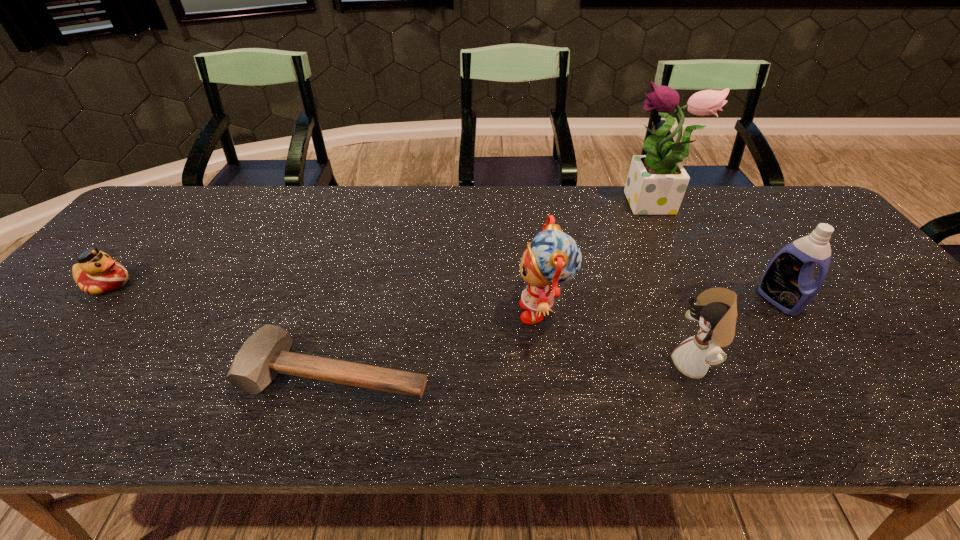
Find the location of a particular element. Image resolution: width=960 pixels, height=540 pixels. vacant area located on the back of the mallet is located at coordinates (368, 260).

Find the location of a particular element. The height and width of the screenshot is (540, 960). object that is at the far edge is located at coordinates (656, 183).

At what (x,y) coordinates should I click in order to perform the action: click on doll that is at the near edge. Please return your answer as a coordinate pair (x, y). The image size is (960, 540). Looking at the image, I should click on (715, 309).

Identify the location of mallet present at the near edge. (266, 353).

Locate an element on the screen. object that is at the left edge is located at coordinates (96, 273).

Image resolution: width=960 pixels, height=540 pixels. What are the coordinates of `vacant space at the far edge` in the screenshot? It's located at (406, 219).

The image size is (960, 540). Identify the location of free space at the near edge of the desktop. (587, 417).

Where is `free space at the left edge of the desktop`? The image size is (960, 540). free space at the left edge of the desktop is located at coordinates (111, 249).

Find the location of a particular element. The height and width of the screenshot is (540, 960). free space at the right edge is located at coordinates (852, 251).

At what (x,y) coordinates should I click in order to perform the action: click on free space between the flower arrangement and the third object from left to right. Please return your answer as a coordinate pair (x, y). Looking at the image, I should click on (598, 259).